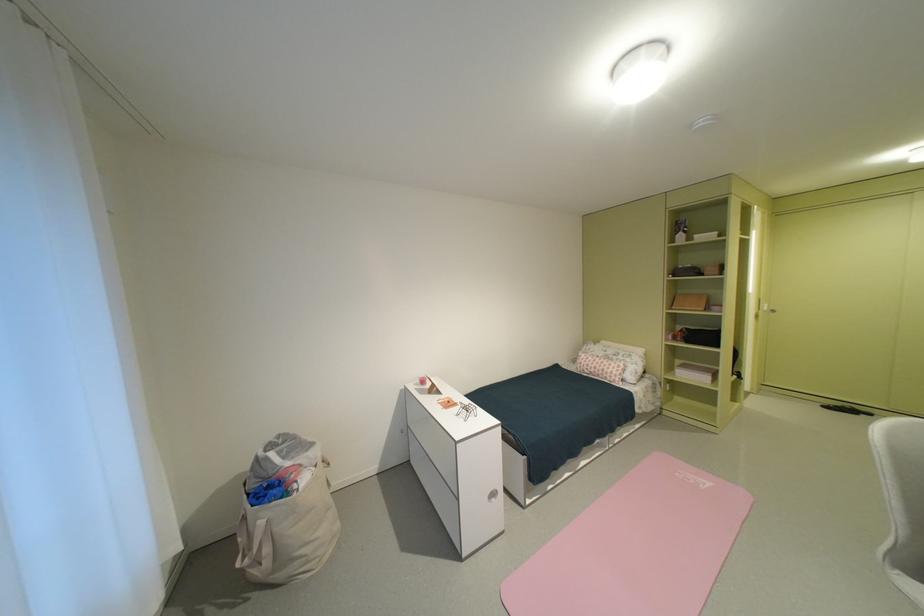
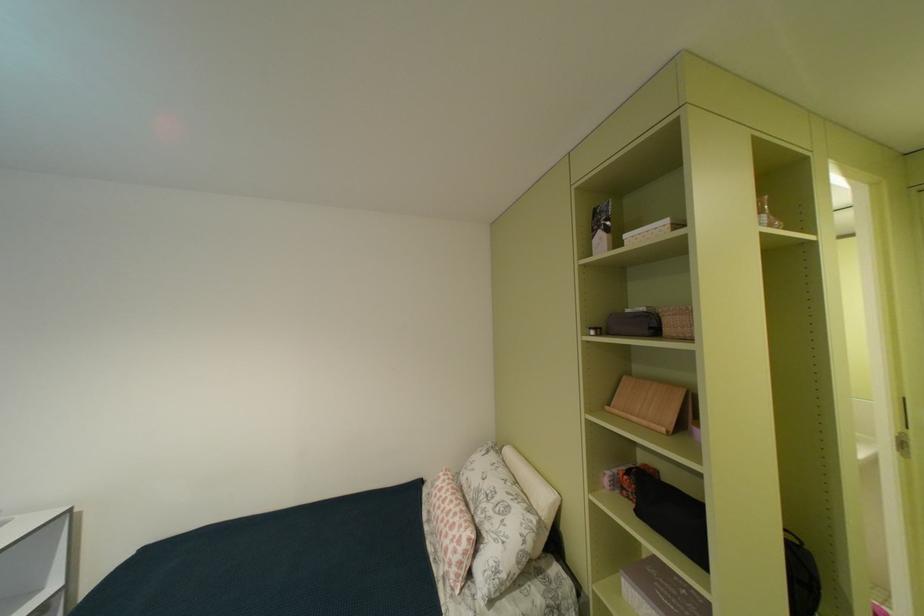
Find the pixel in the second image that matches point (613, 355) in the first image.

(487, 487)